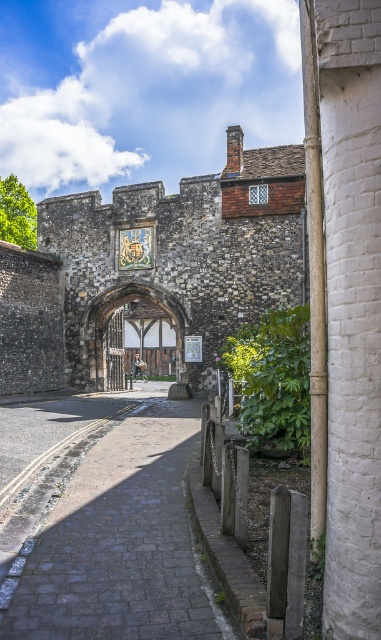
You are standing at the entrance of a medieval village and see the gray cobblestone path at center and the wooden timber archway at center. Which object is located above the other?

The wooden timber archway at center is positioned above the gray cobblestone path at center.

You are standing at the entrance of the historic stone archway and need to find the gray cobblestone path at center. According to the coordinates provided, where should you look to find it?

The gray cobblestone path at center is located at the 2D coordinates point (120, 541), so you should look towards that point to find it.

You are a tourist standing in front of the historic stone archway and want to take a photo that includes both the gray cobblestone path at center and the wooden timber archway at center. Which object should you focus on first to ensure both are in the frame?

The gray cobblestone path at center is smaller than the wooden timber archway at center, so you should focus on the wooden timber archway at center first to ensure both fit in the frame.